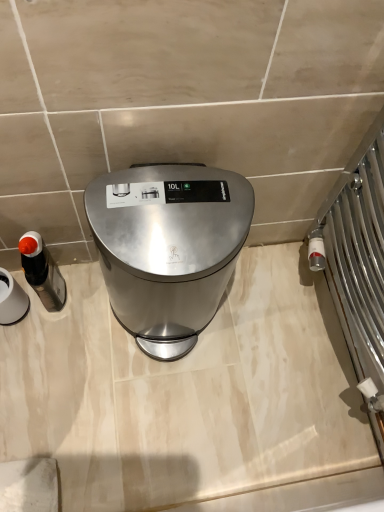
Question: Is matte black soap dispenser at left, which appears as the first appliance when viewed from the right, completely or partially inside matte black soap dispenser at left, the 1th appliance in the left-to-right sequence?

Choices:
 (A) yes
 (B) no

Answer: (B)

Question: Is matte black soap dispenser at left, the 1th appliance in the left-to-right sequence, touching matte black soap dispenser at left, which appears as the first appliance when viewed from the right?

Choices:
 (A) no
 (B) yes

Answer: (B)

Question: Considering the relative positions of matte black soap dispenser at left, the 1th appliance in the left-to-right sequence, and matte black soap dispenser at left, positioned as the 2th appliance in left-to-right order, in the image provided, is matte black soap dispenser at left, the 1th appliance in the left-to-right sequence, to the left of matte black soap dispenser at left, positioned as the 2th appliance in left-to-right order, from the viewer's perspective?

Choices:
 (A) yes
 (B) no

Answer: (A)

Question: Is matte black soap dispenser at left, which ranks as the second appliance in right-to-left order, oriented towards matte black soap dispenser at left, which appears as the first appliance when viewed from the right?

Choices:
 (A) yes
 (B) no

Answer: (B)

Question: Is matte black soap dispenser at left, the 1th appliance in the left-to-right sequence, not close to matte black soap dispenser at left, which appears as the first appliance when viewed from the right?

Choices:
 (A) yes
 (B) no

Answer: (B)

Question: Can you confirm if matte black soap dispenser at left, which ranks as the second appliance in right-to-left order, is thinner than matte black soap dispenser at left, which appears as the first appliance when viewed from the right?

Choices:
 (A) yes
 (B) no

Answer: (B)

Question: Does matte black soap dispenser at left, which appears as the first appliance when viewed from the right, have a smaller size compared to satin silver trash can at center?

Choices:
 (A) yes
 (B) no

Answer: (A)

Question: Does matte black soap dispenser at left, which appears as the first appliance when viewed from the right, have a greater height compared to satin silver trash can at center?

Choices:
 (A) no
 (B) yes

Answer: (A)

Question: Is matte black soap dispenser at left, positioned as the 2th appliance in left-to-right order, touching satin silver trash can at center?

Choices:
 (A) yes
 (B) no

Answer: (B)

Question: Is matte black soap dispenser at left, positioned as the 2th appliance in left-to-right order, further to camera compared to satin silver trash can at center?

Choices:
 (A) no
 (B) yes

Answer: (B)

Question: Is matte black soap dispenser at left, which appears as the first appliance when viewed from the right, facing towards satin silver trash can at center?

Choices:
 (A) no
 (B) yes

Answer: (A)

Question: Is matte black soap dispenser at left, which appears as the first appliance when viewed from the right, not close to satin silver trash can at center?

Choices:
 (A) no
 (B) yes

Answer: (A)

Question: Does matte black soap dispenser at left, which appears as the first appliance when viewed from the right, have a smaller size compared to matte black soap dispenser at left, which ranks as the second appliance in right-to-left order?

Choices:
 (A) yes
 (B) no

Answer: (A)